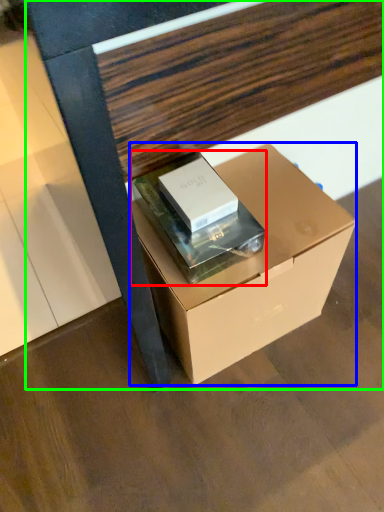
Question: Which is nearer to the paperback book (highlighted by a red box)? box (highlighted by a blue box) or furniture (highlighted by a green box).

Choices:
 (A) box
 (B) furniture

Answer: (A)